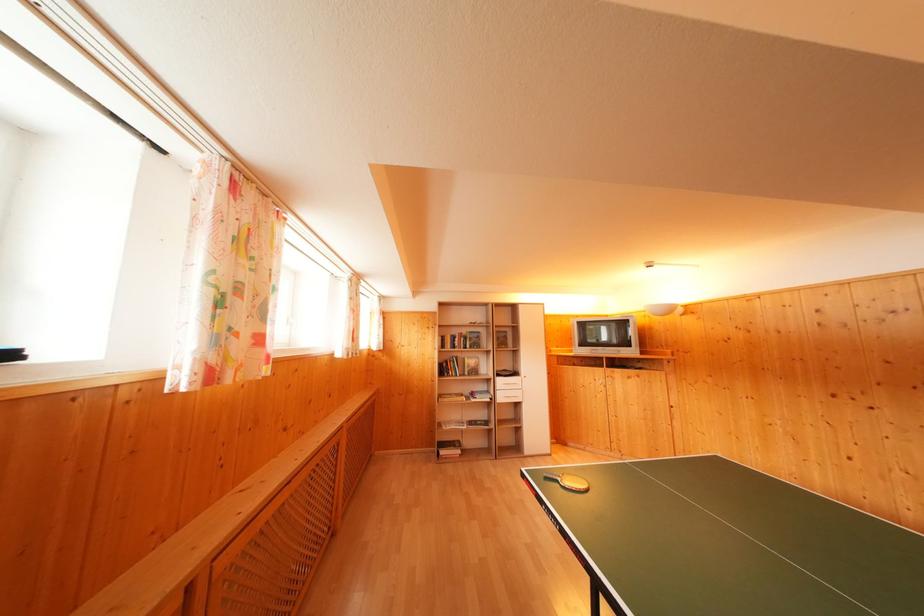
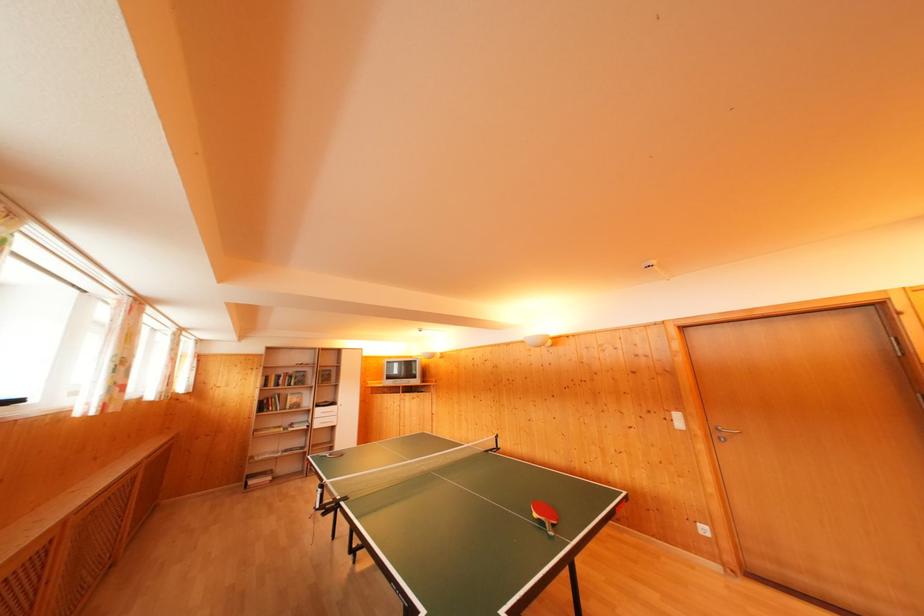
In the second image, find the point that corresponds to pixel 468 336 in the first image.

(296, 376)